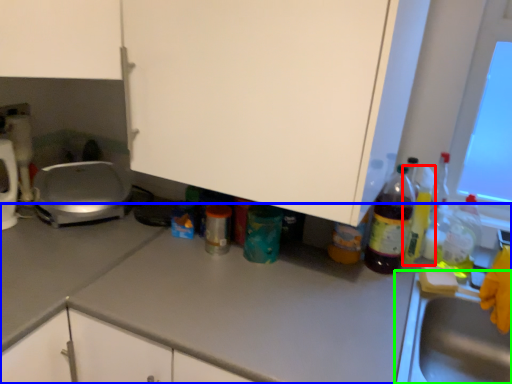
Question: Estimate the real-world distances between objects in this image. Which object is closer to bottle (highlighted by a red box), countertop (highlighted by a blue box) or sink (highlighted by a green box)?

Choices:
 (A) countertop
 (B) sink

Answer: (B)